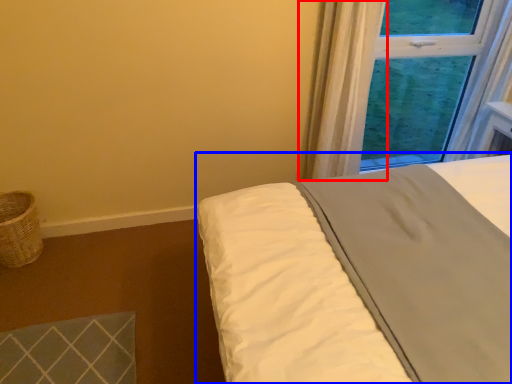
Question: Which object appears farthest to the camera in this image, curtain (highlighted by a red box) or bed (highlighted by a blue box)?

Choices:
 (A) curtain
 (B) bed

Answer: (A)